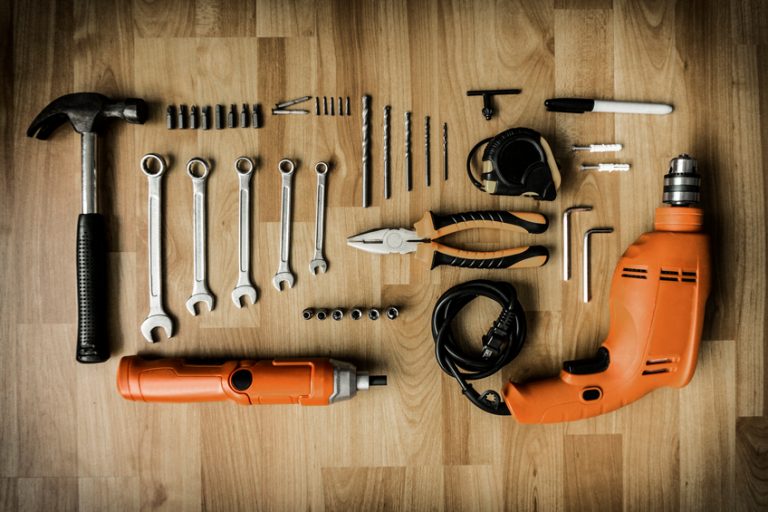
The image size is (768, 512). Identify the location of handle area. (540, 401), (481, 215), (497, 263), (171, 381), (77, 314).